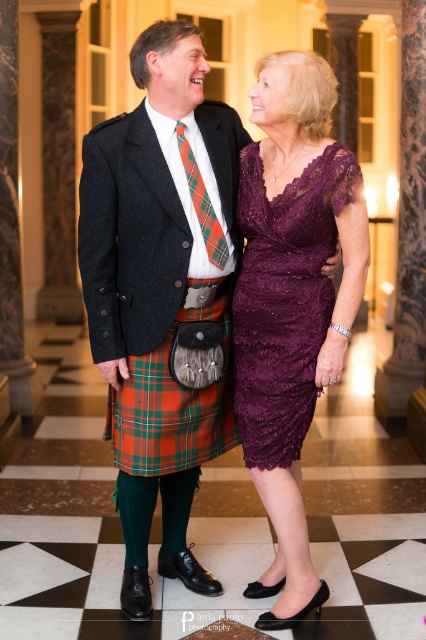
Is orange plaid kilt at center closer to the viewer compared to plaid fabric tie at center?

No, it is behind plaid fabric tie at center.

Measure the distance between point (x=212, y=412) and camera.

Point (x=212, y=412) and camera are 3.11 meters apart from each other.

In order to click on orange plaid kilt at center in this screenshot , I will do `click(170, 408)`.

Which is more to the right, matte black suit at center or plaid fabric tie at center?

plaid fabric tie at center

Can you confirm if matte black suit at center is shorter than plaid fabric tie at center?

Incorrect, matte black suit at center's height does not fall short of plaid fabric tie at center's.

Find the location of `matte black suit at center`. matte black suit at center is located at coordinates (158, 296).

Between point (164, 240) and point (279, 196), which one is positioned in front?

Point (164, 240) is more forward.

Is point (146, 140) behind point (316, 168)?

Yes, it is behind point (316, 168).

The height and width of the screenshot is (640, 426). Find the location of `matte black suit at center`. matte black suit at center is located at coordinates (158, 296).